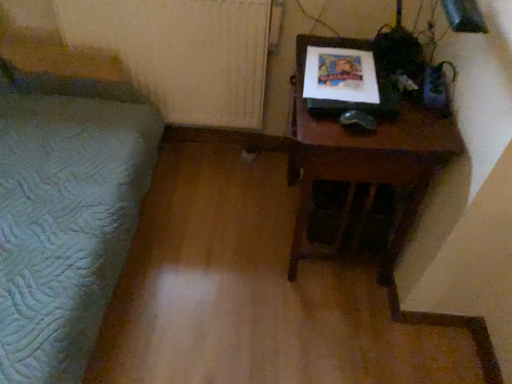
Question: Is there a large distance between green quilted bedspread at left and wooden table at right?

Choices:
 (A) no
 (B) yes

Answer: (A)

Question: Does green quilted bedspread at left contain wooden table at right?

Choices:
 (A) yes
 (B) no

Answer: (B)

Question: Is green quilted bedspread at left at the left side of wooden table at right?

Choices:
 (A) yes
 (B) no

Answer: (A)

Question: From a real-world perspective, is green quilted bedspread at left over wooden table at right?

Choices:
 (A) yes
 (B) no

Answer: (A)

Question: Is green quilted bedspread at left looking in the opposite direction of wooden table at right?

Choices:
 (A) no
 (B) yes

Answer: (A)

Question: In the image, is white textured radiator at upper left positioned in front of or behind wooden table at right?

Choices:
 (A) front
 (B) behind

Answer: (B)

Question: Is white textured radiator at upper left inside the boundaries of wooden table at right, or outside?

Choices:
 (A) outside
 (B) inside

Answer: (A)

Question: From the image's perspective, is white textured radiator at upper left above or below wooden table at right?

Choices:
 (A) above
 (B) below

Answer: (A)

Question: From a real-world perspective, is white textured radiator at upper left physically located above or below wooden table at right?

Choices:
 (A) above
 (B) below

Answer: (A)

Question: Considering their positions, is wooden table at right located in front of or behind white textured radiator at upper left?

Choices:
 (A) front
 (B) behind

Answer: (A)

Question: From a real-world perspective, is wooden table at right physically located above or below white textured radiator at upper left?

Choices:
 (A) above
 (B) below

Answer: (B)

Question: Looking at their shapes, would you say wooden table at right is wider or thinner than white textured radiator at upper left?

Choices:
 (A) wide
 (B) thin

Answer: (A)

Question: From their relative heights in the image, would you say wooden table at right is taller or shorter than white textured radiator at upper left?

Choices:
 (A) tall
 (B) short

Answer: (A)

Question: From a real-world perspective, relative to green quilted bedspread at left, is white textured radiator at upper left vertically above or below?

Choices:
 (A) above
 (B) below

Answer: (B)

Question: From the image's perspective, is white textured radiator at upper left above or below green quilted bedspread at left?

Choices:
 (A) above
 (B) below

Answer: (A)